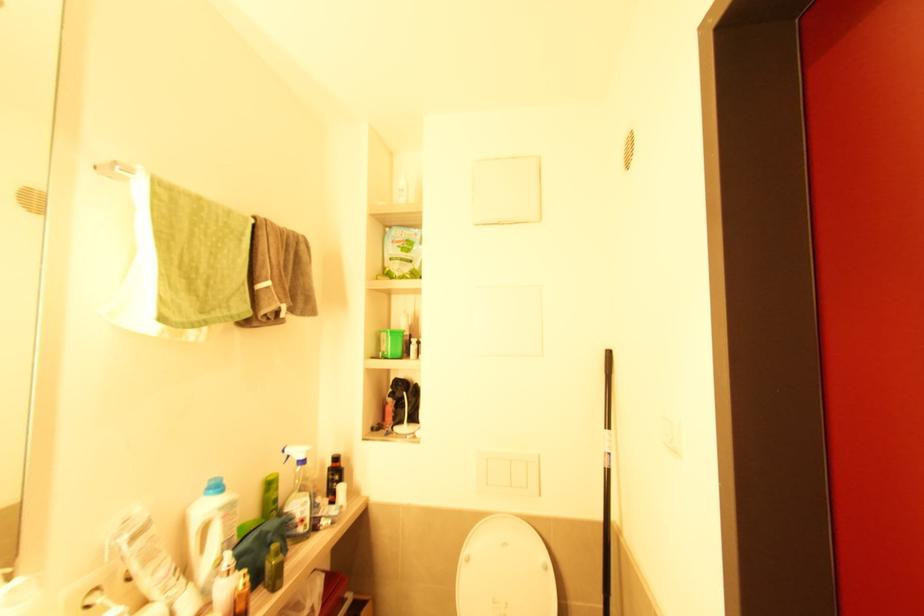
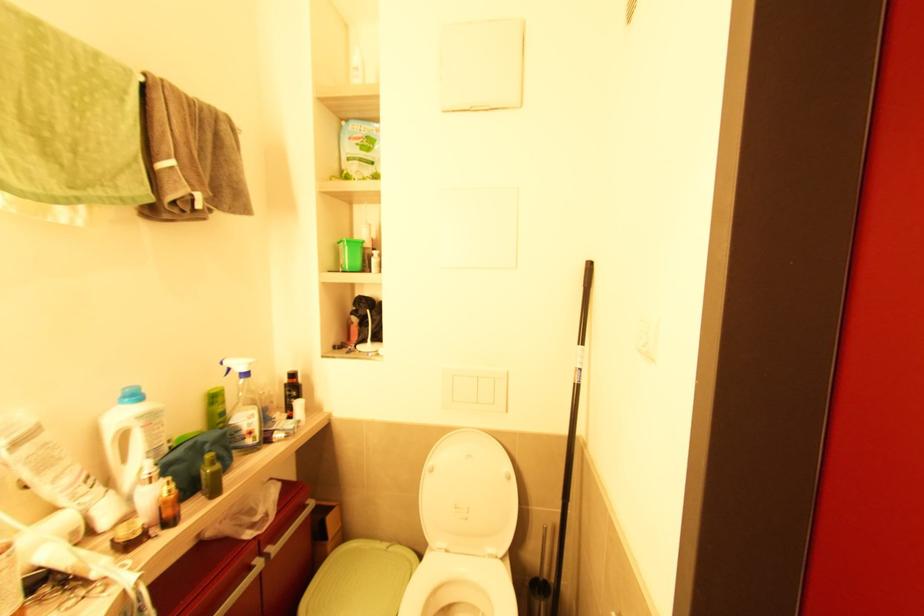
Looking at this image, in a continuous first-person perspective shot, in which direction is the camera moving?

The cameraman moved toward right, forward.